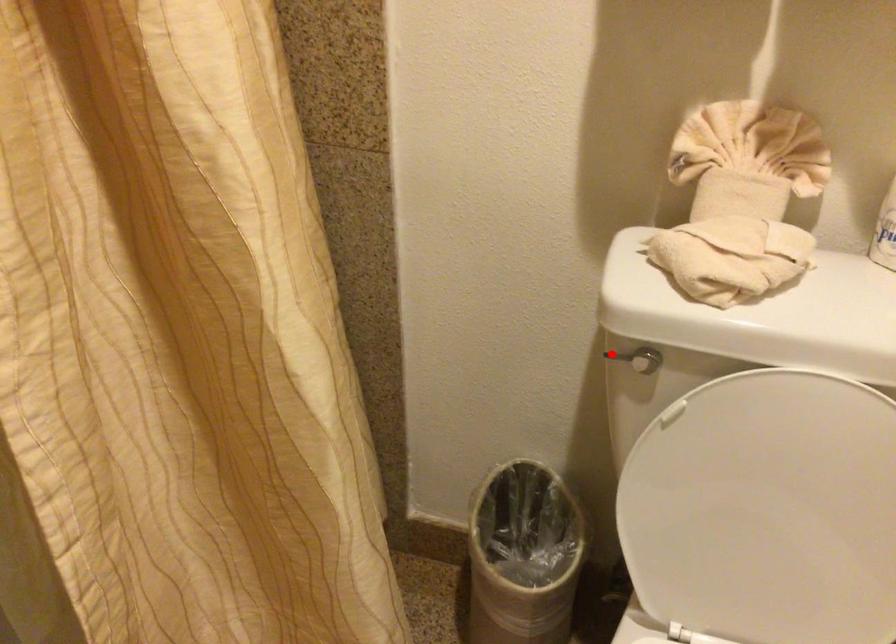
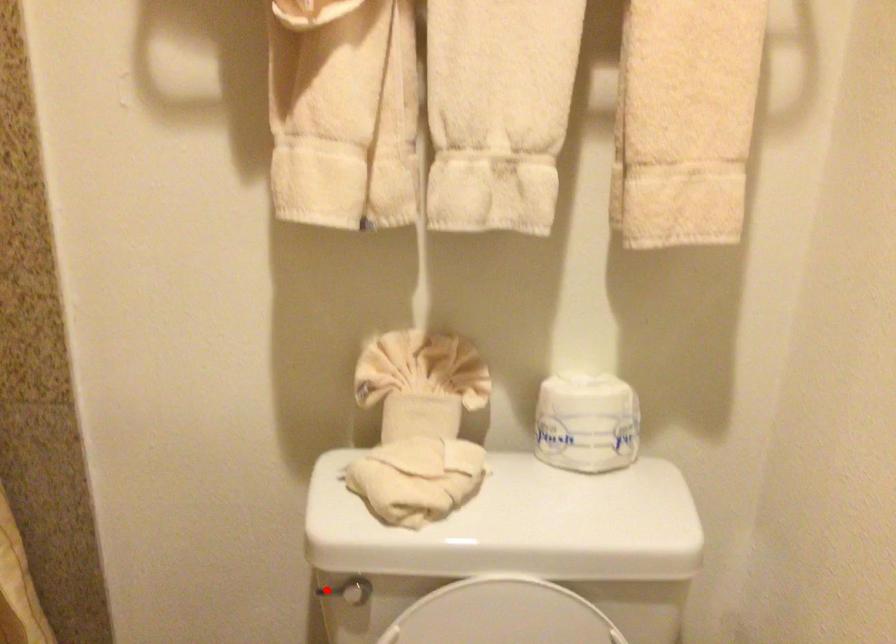
I am providing you with two images of the same scene from different viewpoints. A red point is marked on the first image and another point is marked on the second image. Do the highlighted points in image1 and image2 indicate the same real-world spot?

Yes